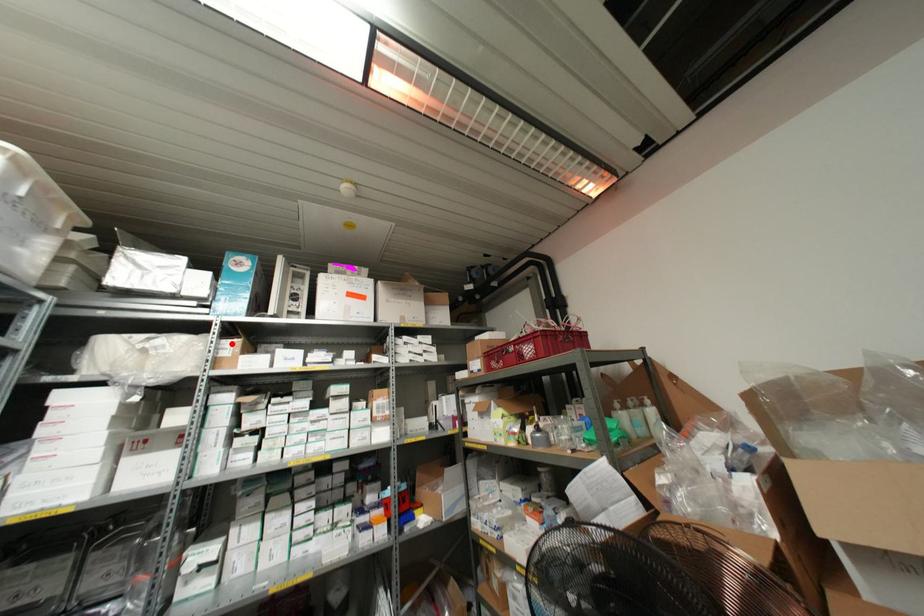
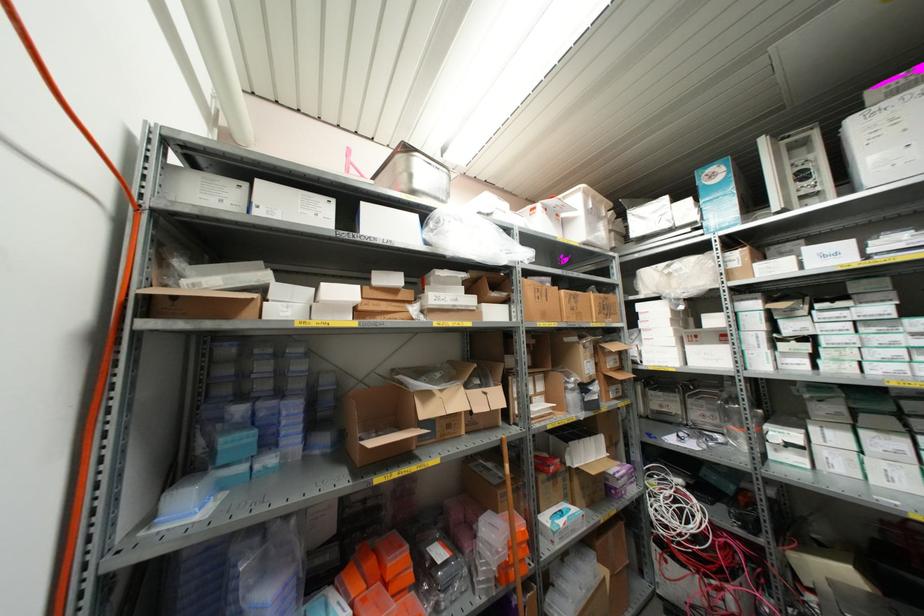
Find the pixel in the second image that matches the highlighted location in the first image.

(737, 254)